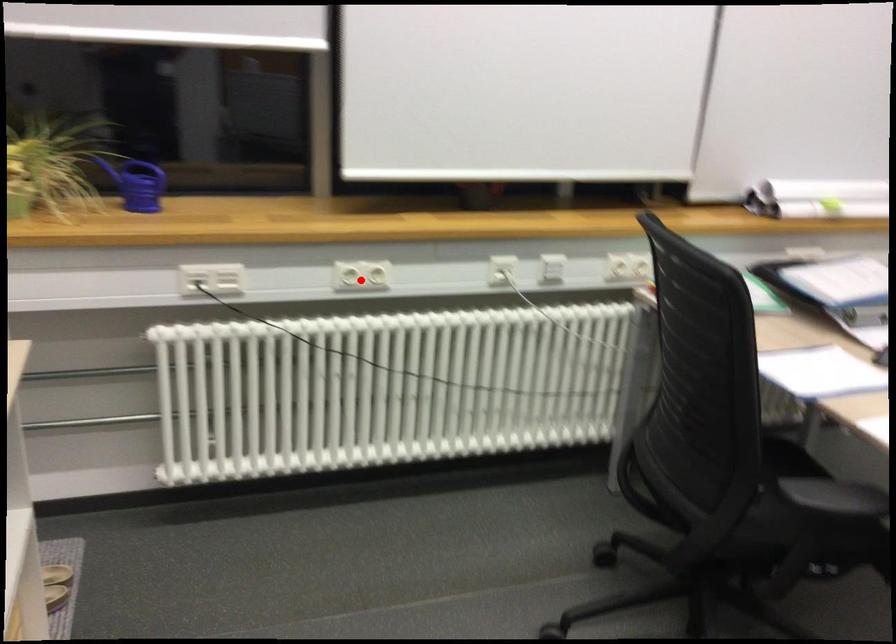
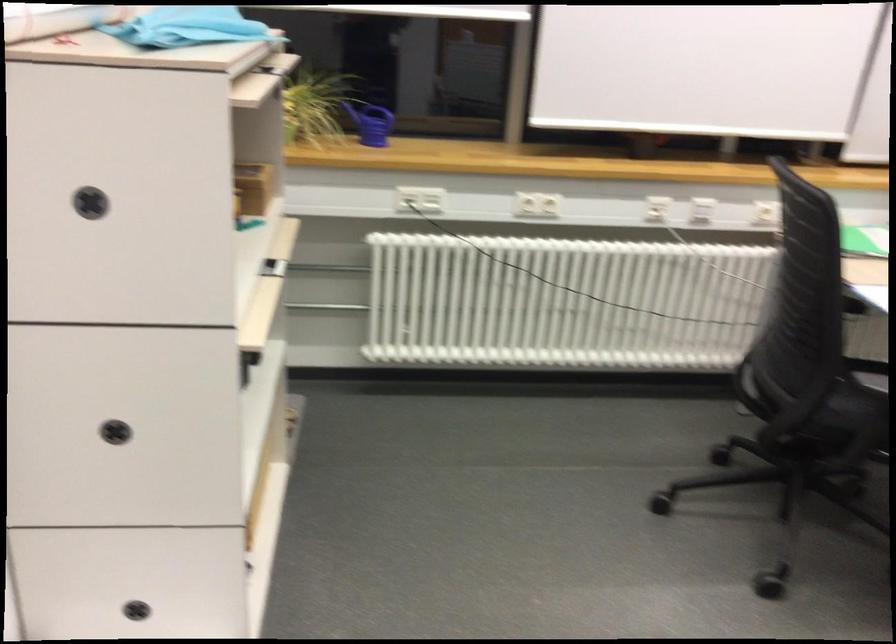
Question: I am providing you with two images of the same scene from different viewpoints. In image1, a red point is highlighted. Considering the same 3D point in image2, which of the following is correct?

Choices:
 (A) It is closer
 (B) It is farther

Answer: (B)